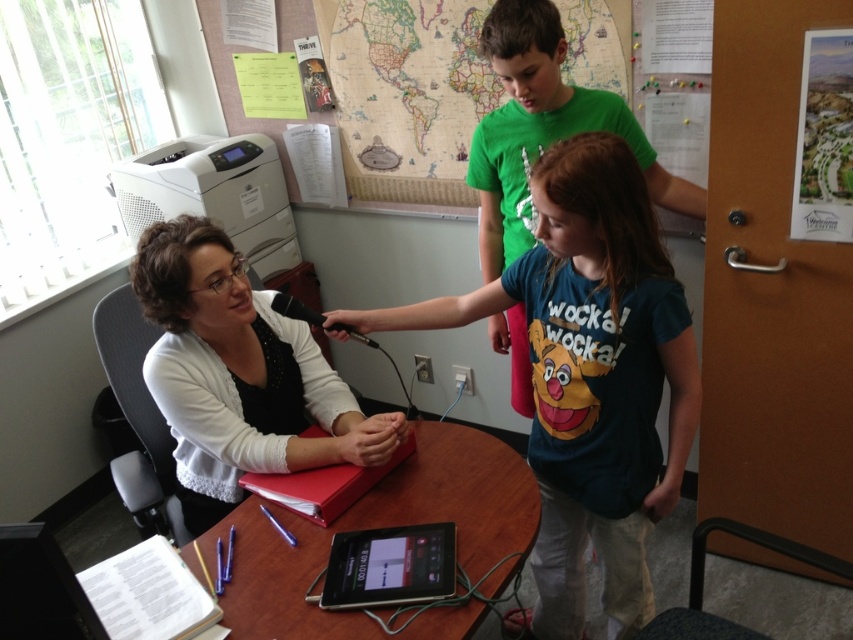
What is the position of the blue cotton shirt at center relative to the point marked at coordinates (589, 374)?

The point marked at coordinates (589, 374) is exactly where the blue cotton shirt at center is located.

You are setting up a video call and need to place a 12 inch laptop on the surface. The wooden table at center and the black glossy tablet at center are both available. Which surface can accommodate the laptop without overhanging the edge?

The wooden table at center has a larger width than the black glossy tablet at center, so the wooden table at center can accommodate the 12 inch laptop without overhanging the edge.